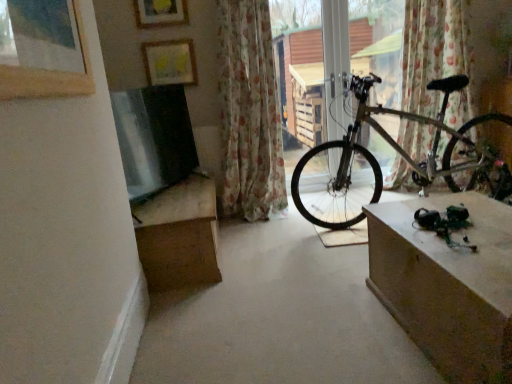
Find the location of a particular element. matte yellow picture frame at upper center, the first picture frame viewed from the back is located at coordinates (170, 62).

How much space does matte yellow picture frame at upper center, acting as the second picture frame starting from the bottom, occupy horizontally?

The width of matte yellow picture frame at upper center, acting as the second picture frame starting from the bottom, is 1.38 inches.

Find the location of a particular element. This screenshot has height=384, width=512. brown cardboard box at lower left is located at coordinates (179, 235).

What is the approximate width of brown cardboard box at lower left?

The width of brown cardboard box at lower left is 28.12 inches.

Where is `metallic bicycle at center`? Image resolution: width=512 pixels, height=384 pixels. metallic bicycle at center is located at coordinates (300, 68).

Identify the location of wooden picture frame at upper left, the first picture frame positioned from the front. (49, 76).

The width and height of the screenshot is (512, 384). Describe the element at coordinates (431, 50) in the screenshot. I see `floral fabric curtain at right, which appears as the 1th curtain when viewed from the right` at that location.

Where is `metallic silver bicycle at center`? metallic silver bicycle at center is located at coordinates (400, 154).

What's the angular difference between brown cardboard box at lower left and floral fabric curtain at center, the 1th curtain in the left-to-right sequence,'s facing directions?

They differ by 90.1 degrees in their facing directions.

Is brown cardboard box at lower left facing away from floral fabric curtain at center, positioned as the second curtain in right-to-left order?

No, floral fabric curtain at center, positioned as the second curtain in right-to-left order, is not at the back of brown cardboard box at lower left.

Which is more to the right, brown cardboard box at lower left or floral fabric curtain at center, positioned as the second curtain in right-to-left order?

From the viewer's perspective, floral fabric curtain at center, positioned as the second curtain in right-to-left order, appears more on the right side.

Is brown cardboard box at lower left in front of or behind floral fabric curtain at center, positioned as the second curtain in right-to-left order, in the image?

In the image, brown cardboard box at lower left appears in front of floral fabric curtain at center, positioned as the second curtain in right-to-left order.

In the scene shown: Considering the relative positions of metallic silver bicycle at center and wooden picture frame at upper left, the 3th picture frame when ordered from top to bottom, in the image provided, is metallic silver bicycle at center behind wooden picture frame at upper left, the 3th picture frame when ordered from top to bottom,?

Yes, metallic silver bicycle at center is further from the camera.

Could wooden picture frame at upper left, the first picture frame positioned from the front, be considered to be inside metallic silver bicycle at center?

No, wooden picture frame at upper left, the first picture frame positioned from the front, is located outside of metallic silver bicycle at center.

Visually, is metallic silver bicycle at center positioned to the left or to the right of wooden picture frame at upper left, placed as the 3th picture frame when sorted from back to front?

metallic silver bicycle at center is positioned on wooden picture frame at upper left, placed as the 3th picture frame when sorted from back to front,'s right side.

From the image's perspective, is metallic silver bicycle at center over wooden picture frame at upper left, the 1th picture frame from the bottom?

No.

Is matte brown table at right completely or partially outside of metallic silver bicycle at center?

Yes.

In the image, is matte brown table at right on the left side or the right side of metallic silver bicycle at center?

Clearly, matte brown table at right is on the left of metallic silver bicycle at center in the image.

Is matte brown table at right smaller than metallic silver bicycle at center?

Yes.

How many degrees apart are the facing directions of concretesmoothconcrete at center and metallic bicycle at center?

The angle between the facing direction of concretesmoothconcrete at center and the facing direction of metallic bicycle at center is 0.532 degrees.

Is concretesmoothconcrete at center thinner than metallic bicycle at center?

In fact, concretesmoothconcrete at center might be wider than metallic bicycle at center.

Is concretesmoothconcrete at center next to metallic bicycle at center and touching it?

No, concretesmoothconcrete at center is not making contact with metallic bicycle at center.

Consider the image. From a real-world perspective, which object stands above the other?

metallic bicycle at center.

Is matte brown table at right situated inside matte yellow picture frame at upper center, which is the 3th picture frame from front to back, or outside?

matte brown table at right is not enclosed by matte yellow picture frame at upper center, which is the 3th picture frame from front to back.

Between matte brown table at right and matte yellow picture frame at upper center, the second picture frame from the top, which one appears on the left side from the viewer's perspective?

From the viewer's perspective, matte yellow picture frame at upper center, the second picture frame from the top, appears more on the left side.

From a real-world perspective, is matte brown table at right above or below matte yellow picture frame at upper center, acting as the second picture frame starting from the bottom?

In terms of real-world spatial position, matte brown table at right is below matte yellow picture frame at upper center, acting as the second picture frame starting from the bottom.

Which of these two, matte brown table at right or matte yellow picture frame at upper center, the first picture frame viewed from the back, stands shorter?

With less height is matte yellow picture frame at upper center, the first picture frame viewed from the back.

Is metallic silver bicycle at center not close to matte yellow picture frame at upper center, which is the 3th picture frame from front to back?

That's right, there is a large distance between metallic silver bicycle at center and matte yellow picture frame at upper center, which is the 3th picture frame from front to back.

From the image's perspective, is metallic silver bicycle at center positioned above or below matte yellow picture frame at upper center, the first picture frame viewed from the back?

Clearly, from the image's perspective, metallic silver bicycle at center is below matte yellow picture frame at upper center, the first picture frame viewed from the back.

Which object is positioned more to the right, metallic silver bicycle at center or matte yellow picture frame at upper center, the second picture frame from the top?

From the viewer's perspective, metallic silver bicycle at center appears more on the right side.

Is metallic silver bicycle at center in front of or behind matte yellow picture frame at upper center, acting as the second picture frame starting from the bottom, in the image?

metallic silver bicycle at center is positioned closer to the viewer than matte yellow picture frame at upper center, acting as the second picture frame starting from the bottom.

Is wooden frame at upper center, placed as the second picture frame when sorted from back to front, positioned with its back to matte yellow picture frame at upper center, acting as the second picture frame starting from the bottom?

No.

Is point (135, 12) closer to viewer compared to point (190, 41)?

Yes, point (135, 12) is in front of point (190, 41).

Is wooden frame at upper center, placed as the second picture frame when sorted from back to front, inside or outside of matte yellow picture frame at upper center, the second picture frame from the top?

The correct answer is: outside.

Identify the location of the 2nd curtain located above the brown cardboard box at lower left (from a real-world perspective). (249, 112).

There is a metallic silver bicycle at center. At what (x,y) coordinates should I click in order to perform the action: click on the 1st picture frame above it (from the image's perspective). Please return your answer as a coordinate pair (x, y). The image size is (512, 384). Looking at the image, I should click on (x=49, y=76).

From the image, which object appears to be farther from matte brown table at right, metallic bicycle at center or floral fabric curtain at center, positioned as the second curtain in right-to-left order?

The object further to matte brown table at right is metallic bicycle at center.

Considering their positions, is brown cardboard box at lower left positioned further to matte brown table at right than floral fabric curtain at center, positioned as the second curtain in right-to-left order?

The object further to matte brown table at right is floral fabric curtain at center, positioned as the second curtain in right-to-left order.

Looking at the image, which one is located closer to metallic silver bicycle at center, floral fabric curtain at center, the 1th curtain in the left-to-right sequence, or matte brown table at right?

floral fabric curtain at center, the 1th curtain in the left-to-right sequence, is positioned closer to the anchor metallic silver bicycle at center.

When comparing their distances from floral fabric curtain at center, positioned as the second curtain in right-to-left order, does concretesmoothconcrete at center or matte yellow picture frame at upper center, the first picture frame viewed from the back, seem closer?

matte yellow picture frame at upper center, the first picture frame viewed from the back, is closer to floral fabric curtain at center, positioned as the second curtain in right-to-left order.

When comparing their distances from matte brown table at right, does metallic bicycle at center or matte yellow picture frame at upper center, the second picture frame from the top, seem closer?

The object closer to matte brown table at right is matte yellow picture frame at upper center, the second picture frame from the top.

When comparing their distances from metallic silver bicycle at center, does matte yellow picture frame at upper center, acting as the second picture frame starting from the bottom, or brown cardboard box at lower left seem further?

The object further to metallic silver bicycle at center is matte yellow picture frame at upper center, acting as the second picture frame starting from the bottom.

From the image, which object appears to be nearer to metallic bicycle at center, brown cardboard box at lower left or floral fabric curtain at center, positioned as the second curtain in right-to-left order?

Based on the image, floral fabric curtain at center, positioned as the second curtain in right-to-left order, appears to be nearer to metallic bicycle at center.

In the scene shown: Based on their spatial positions, is wooden picture frame at upper left, the 3th picture frame when ordered from top to bottom, or metallic silver bicycle at center further from matte yellow picture frame at upper center, which is the 3th picture frame from front to back?

Among the two, wooden picture frame at upper left, the 3th picture frame when ordered from top to bottom, is located further to matte yellow picture frame at upper center, which is the 3th picture frame from front to back.

Locate an element on the screen. This screenshot has height=384, width=512. curtain between wooden frame at upper center, the 2th picture frame when ordered from front to back, and metallic bicycle at center, in the horizontal direction is located at coordinates (249, 112).

What are the coordinates of `table between wooden picture frame at upper left, placed as the 3th picture frame when sorted from back to front, and metallic bicycle at center, along the z-axis` in the screenshot? It's located at (447, 284).

Where is `curtain situated between wooden frame at upper center, which is counted as the third picture frame, starting from the bottom, and metallic silver bicycle at center from left to right`? The width and height of the screenshot is (512, 384). curtain situated between wooden frame at upper center, which is counted as the third picture frame, starting from the bottom, and metallic silver bicycle at center from left to right is located at coordinates pos(249,112).

You are a GUI agent. You are given a task and a screenshot of the screen. Output one action in this format:
    pyautogui.click(x=<x>, y=<y>)
    Task: Click on the picture frame between concretesmoothconcrete at center and matte yellow picture frame at upper center, the first picture frame viewed from the back, in the front-back direction
    
    Given the screenshot: What is the action you would take?
    pyautogui.click(x=160, y=13)